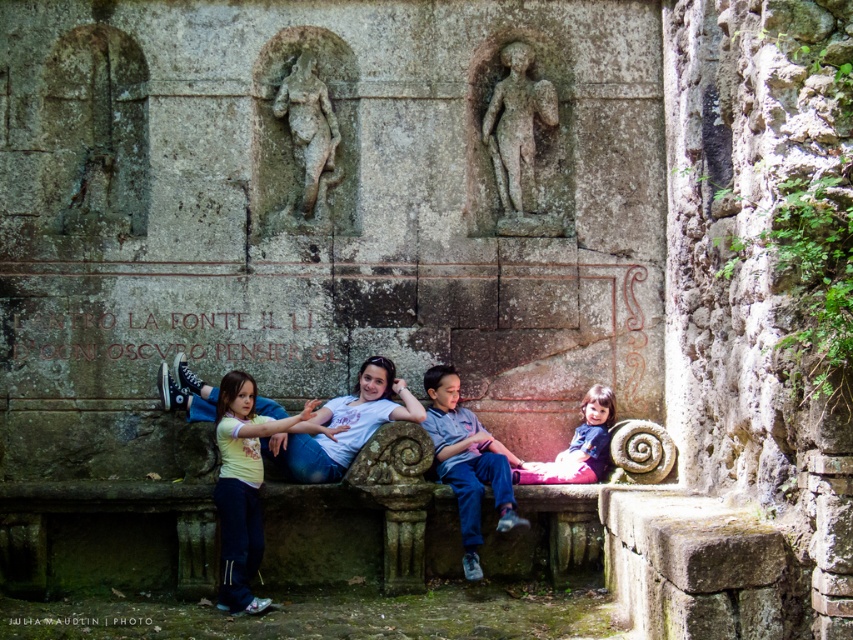
You are standing in front of the ancient wall with the group of people. Where is the gray stone statue at center located in relation to the group?

The gray stone statue at center is located at the coordinates point (x=526, y=148).

You are planning to place a small potted plant between the matte stone bench at center and the matte gray stone bench at center. Based on their positions, which bench should the plant be closer to?

The matte stone bench at center is positioned on the left side of the matte gray stone bench at center. Therefore, the plant should be placed closer to the matte gray stone bench at center to maintain symmetry between the two benches.